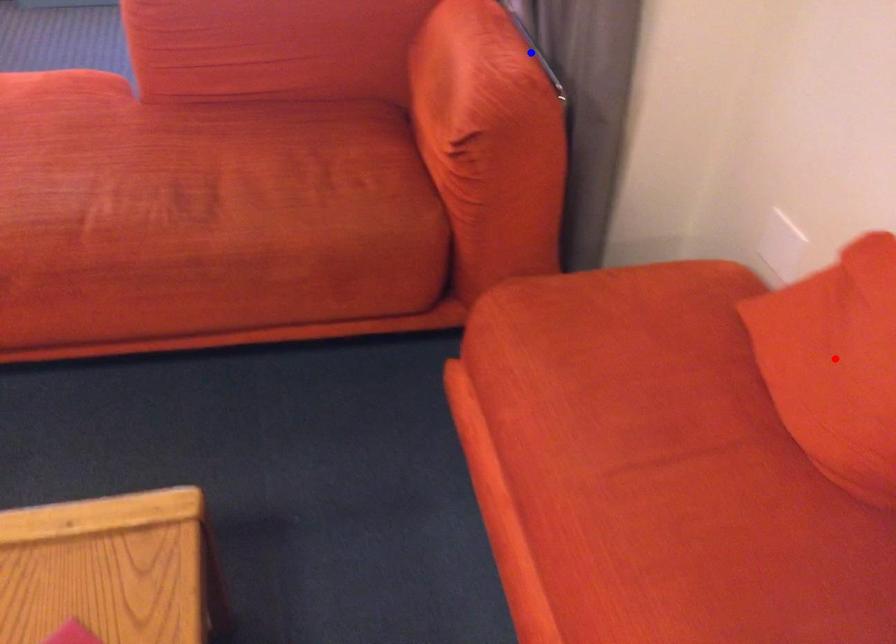
Question: In the image, two points are highlighted. Which point is nearer to the camera? Reply with the corresponding letter.

Choices:
 (A) blue point
 (B) red point

Answer: (B)